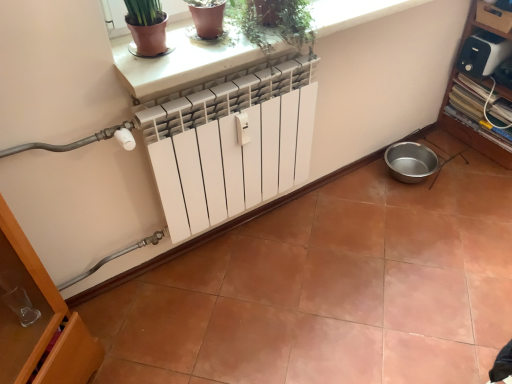
Question: Is green matte plant at upper center wider or thinner than white smooth ledge at upper center?

Choices:
 (A) thin
 (B) wide

Answer: (A)

Question: Is green matte plant at upper center in front of or behind white smooth ledge at upper center in the image?

Choices:
 (A) front
 (B) behind

Answer: (A)

Question: Which object is positioned farthest from the white plastic toaster at upper right?

Choices:
 (A) white smooth ledge at upper center
 (B) green matte plant at upper center
 (C) white glossy radiator at center
 (D) metallic silver shelf at right

Answer: (B)

Question: Which of these objects is positioned farthest from the metallic silver shelf at right?

Choices:
 (A) white plastic toaster at upper right
 (B) green matte plant at upper center
 (C) white smooth ledge at upper center
 (D) white glossy radiator at center

Answer: (B)